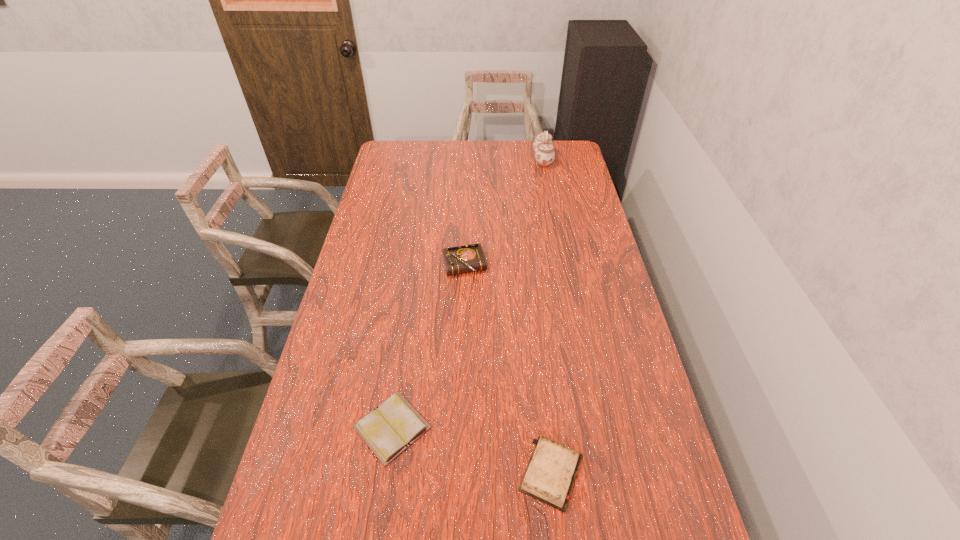
I want to click on the tallest object, so click(543, 146).

This screenshot has width=960, height=540. What are the coordinates of `chinaware` in the screenshot? It's located at tap(543, 146).

Where is `the third shortest object`? the third shortest object is located at coordinates (469, 258).

Find the location of a particular element. The image size is (960, 540). the tallest diary is located at coordinates (469, 258).

Locate an element on the screen. Image resolution: width=960 pixels, height=540 pixels. the second shortest diary is located at coordinates pyautogui.click(x=549, y=477).

Locate an element on the screen. the third tallest object is located at coordinates (549, 477).

Identify the location of the shortest diary. The height and width of the screenshot is (540, 960). (394, 425).

Where is `vacant space located 0.300m by the handle of the tallest object`? vacant space located 0.300m by the handle of the tallest object is located at coordinates tap(469, 159).

Locate an element on the screen. The width and height of the screenshot is (960, 540). vacant space situated by the handle of the tallest object is located at coordinates (463, 159).

Locate an element on the screen. vacant region located by the handle of the tallest object is located at coordinates (494, 159).